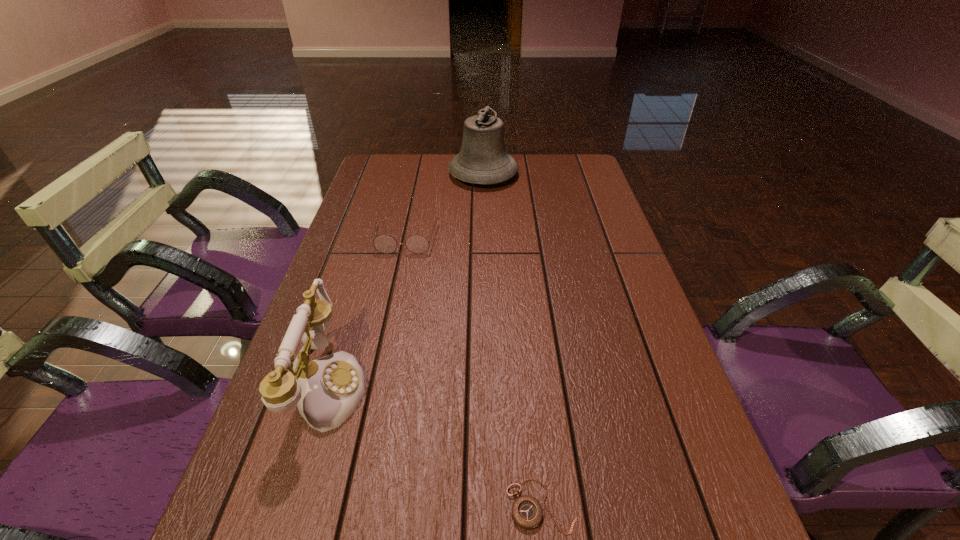
Identify the location of blank space located on the temples of the second shortest object. point(388,321).

At what (x,y) coordinates should I click in order to perform the action: click on vacant region located 0.300m on the back of the nearest object. Please return your answer as a coordinate pair (x, y). This screenshot has width=960, height=540. Looking at the image, I should click on (525, 341).

Identify the location of object that is at the far edge. (483, 159).

Image resolution: width=960 pixels, height=540 pixels. In order to click on telephone that is at the left edge in this screenshot , I will do `click(327, 391)`.

What are the coordinates of `spectacles at the left edge` in the screenshot? It's located at click(386, 244).

Identify the location of vacant region at the far edge. (542, 170).

Locate an element on the screen. This screenshot has width=960, height=540. free space at the left edge is located at coordinates (340, 263).

Identify the location of vacant space at the right edge. (601, 291).

Locate an element on the screen. The height and width of the screenshot is (540, 960). free region at the far left corner of the desktop is located at coordinates (373, 173).

Where is `vacant space at the far right corner of the desktop`? vacant space at the far right corner of the desktop is located at coordinates (580, 181).